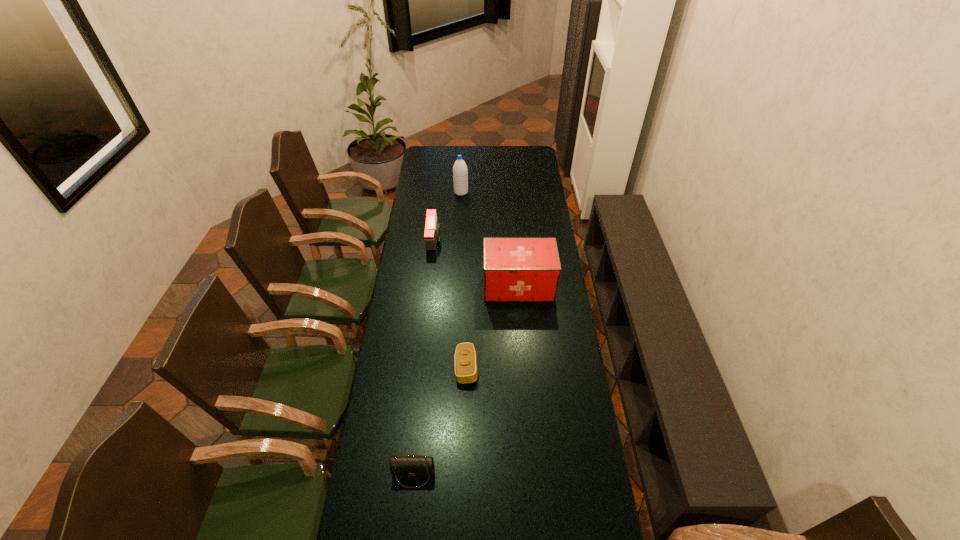
Where is `vacant region between the third tallest object and the right clutch bag`? The image size is (960, 540). vacant region between the third tallest object and the right clutch bag is located at coordinates (450, 304).

Find the location of a particular element. empty space between the farther clutch bag and the third farthest object is located at coordinates (492, 327).

You are a GUI agent. You are given a task and a screenshot of the screen. Output one action in this format:
    pyautogui.click(x=<x>, y=<y>)
    Task: Click on the free space between the right clutch bag and the fourth shortest object
    Image resolution: width=960 pixels, height=540 pixels.
    Given the screenshot: What is the action you would take?
    pyautogui.click(x=492, y=327)

Locate which object ranks in proximity to the nearer clutch bag. Please provide its 2D coordinates. Your answer should be formatted as a tuple, i.e. [(x, y)], where the tuple contains the x and y coordinates of a point satisfying the conditions above.

[(465, 355)]

Identify which object is located as the fourth nearest to the fourth farthest object. Please provide its 2D coordinates. Your answer should be formatted as a tuple, i.e. [(x, y)], where the tuple contains the x and y coordinates of a point satisfying the conditions above.

[(460, 172)]

What are the coordinates of `free space that satisfies the following two spatial constraints: 1. on the zipper side of the farther clutch bag; 2. on the front flap of the nearer clutch bag` in the screenshot? It's located at (464, 475).

Where is `vacant area in the image that satisfies the following two spatial constraints: 1. on the front side of the farthest object; 2. on the front-facing side of the fourth nearest object`? The width and height of the screenshot is (960, 540). vacant area in the image that satisfies the following two spatial constraints: 1. on the front side of the farthest object; 2. on the front-facing side of the fourth nearest object is located at coordinates (459, 240).

The height and width of the screenshot is (540, 960). I want to click on blank space that satisfies the following two spatial constraints: 1. on the handle side of the first-aid kit; 2. on the front flap of the left clutch bag, so click(x=534, y=475).

What are the coordinates of `vacant position in the image that satisfies the following two spatial constraints: 1. on the zipper side of the second nearest object; 2. on the front flap of the nearer clutch bag` in the screenshot? It's located at (464, 475).